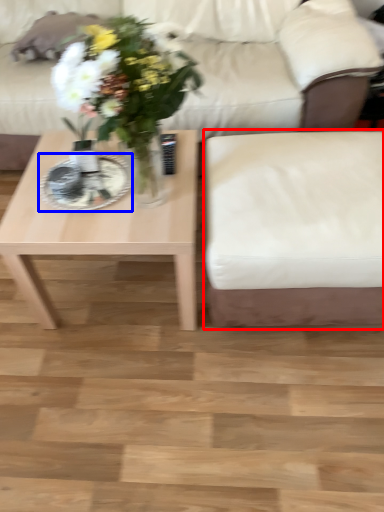
Question: Which object is closer to the camera taking this photo, armchair (highlighted by a red box) or plate (highlighted by a blue box)?

Choices:
 (A) armchair
 (B) plate

Answer: (A)